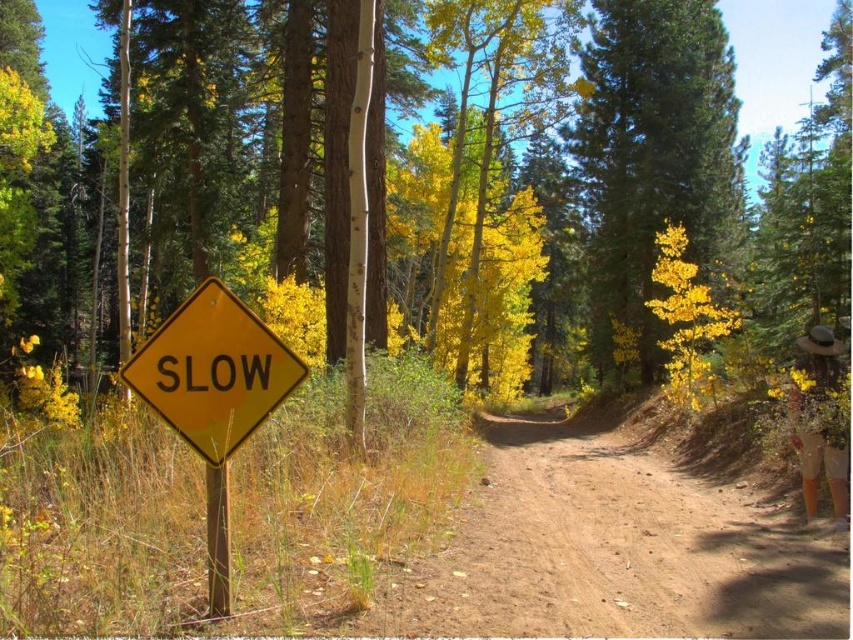
You are standing at point [281,394] and want to walk to the forest exit located at point [724,540]. Since the path is narrow, you need to know if you can walk directly towards the exit without going backward. Can you proceed straight ahead?

Point [724,540] is behind point [281,394], so you cannot proceed straight ahead towards the exit because it is in the opposite direction of where you are facing. You would need to turn around to face the correct direction.